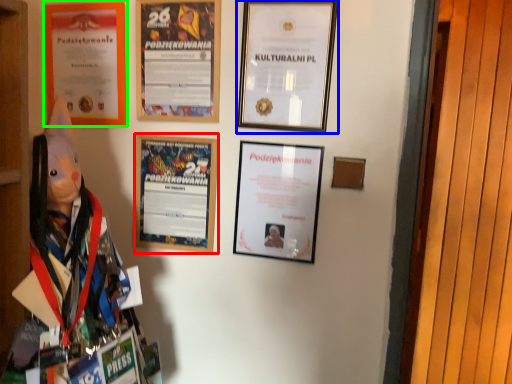
Question: Which is nearer to the picture frame (highlighted by a red box)? picture frame (highlighted by a blue box) or picture frame (highlighted by a green box).

Choices:
 (A) picture frame
 (B) picture frame

Answer: (B)